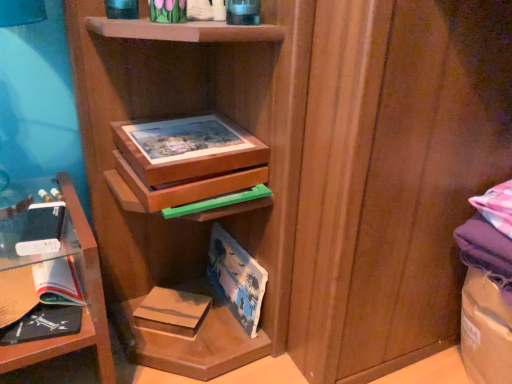
Question: Is point (74, 317) closer or farther from the camera than point (193, 322)?

Choices:
 (A) closer
 (B) farther

Answer: (A)

Question: Is black matte book at lower left in front of or behind brown cardboard book at lower center, the second paperback book from the left, in the image?

Choices:
 (A) behind
 (B) front

Answer: (B)

Question: Which is farther from the wooden puzzle box at center?

Choices:
 (A) clear glass shelf at left
 (B) brown cardboard book at lower center, the second paperback book from the left
 (C) black matte book at lower left
 (D) matte paper paperback book at center, the first paperback book in the right-to-left sequence
 (E) white glossy paperback book at lower left, the 1th paperback book in the left-to-right sequence

Answer: (B)

Question: Which is nearer to the black matte book at lower left?

Choices:
 (A) clear glass shelf at left
 (B) brown cardboard book at lower center, the second paperback book from the left
 (C) wooden puzzle box at center
 (D) white glossy paperback book at lower left, which is counted as the 3th paperback book, starting from the right
 (E) matte paper paperback book at center, arranged as the third paperback book when viewed from the left

Answer: (D)